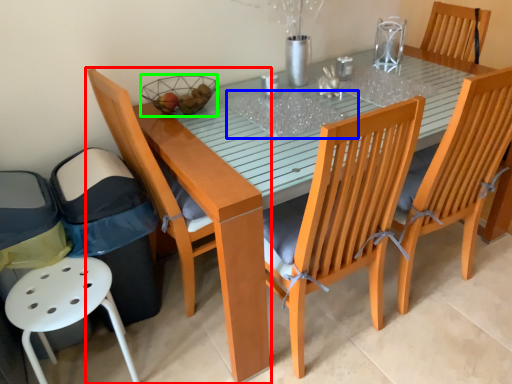
Question: Which is nearer to the chair (highlighted by a red box)? glass table (highlighted by a blue box) or basket (highlighted by a green box).

Choices:
 (A) glass table
 (B) basket

Answer: (B)